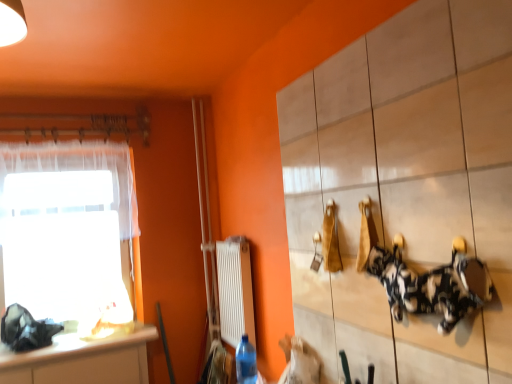
This screenshot has width=512, height=384. I want to click on empty space that is ontop of white tile cabinet at upper right (from a real-world perspective), so [x=349, y=42].